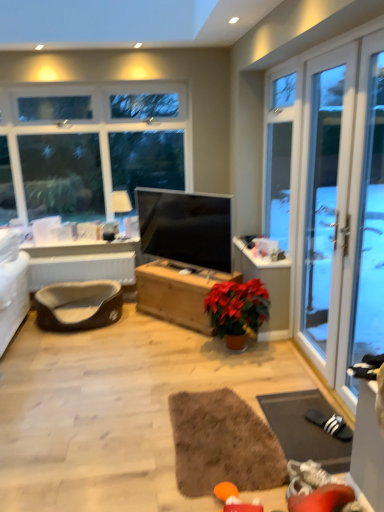
Where is `vacant space that is in between brown plush pet bed at lower left and dark gray rubber yoga mat at lower right, the first yoga mat viewed from the right`? Image resolution: width=384 pixels, height=512 pixels. vacant space that is in between brown plush pet bed at lower left and dark gray rubber yoga mat at lower right, the first yoga mat viewed from the right is located at coordinates (152, 358).